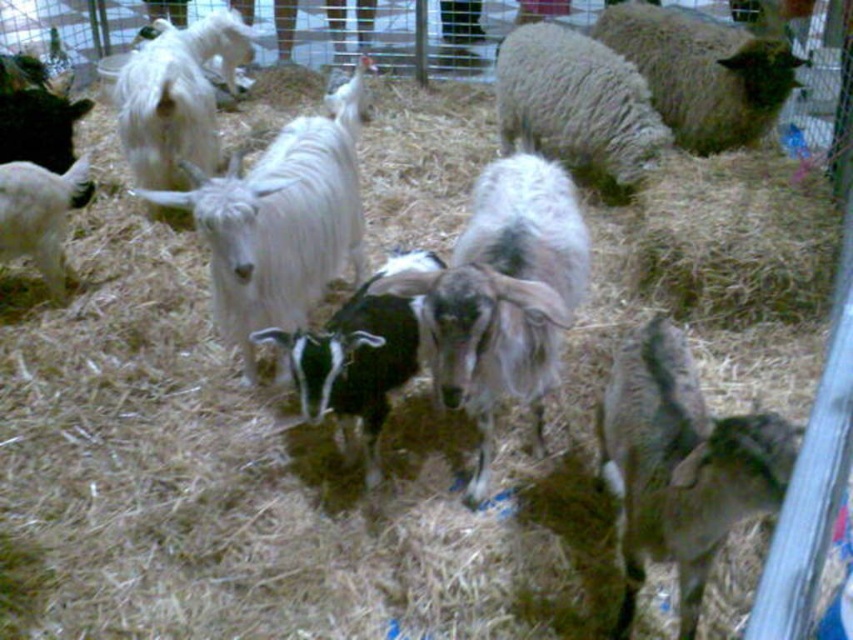
Which of these two, black and white fur goat at center or dark brown woolen goat at lower right, stands shorter?

dark brown woolen goat at lower right

Between black and white fur goat at center and dark brown woolen goat at lower right, which one is positioned lower?

Positioned lower is dark brown woolen goat at lower right.

Locate an element on the screen. The image size is (853, 640). black and white fur goat at center is located at coordinates (x=502, y=298).

Can you confirm if white woolen sheep at center is positioned below fluffy white sheep at upper right?

Correct, white woolen sheep at center is located below fluffy white sheep at upper right.

Between point (527, 70) and point (695, 99), which one is positioned in front?

Point (527, 70) is in front.

Who is more distant from viewer, [509,116] or [717,141]?

Point [509,116]

Locate an element on the screen. white woolen sheep at center is located at coordinates (576, 106).

Between black and white fur at center and white woolen goat at left, which one is positioned higher?

white woolen goat at left is higher up.

Consider the image. Who is positioned more to the right, black and white fur at center or white woolen goat at left?

black and white fur at center

In order to click on black and white fur at center in this screenshot , I will do `click(357, 358)`.

You are a GUI agent. You are given a task and a screenshot of the screen. Output one action in this format:
    pyautogui.click(x=<x>, y=<y>)
    Task: Click on the black and white fur at center
    
    Given the screenshot: What is the action you would take?
    pyautogui.click(x=357, y=358)